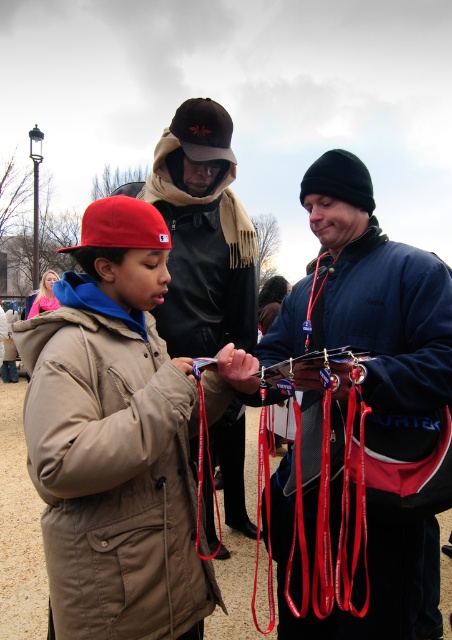
Is matte khaki jacket at center shorter than velvet blue jacket at center?

Indeed, matte khaki jacket at center has a lesser height compared to velvet blue jacket at center.

Can you confirm if matte khaki jacket at center is smaller than velvet blue jacket at center?

Yes, matte khaki jacket at center is smaller than velvet blue jacket at center.

This screenshot has height=640, width=452. In order to click on matte khaki jacket at center in this screenshot , I will do `click(114, 440)`.

Where is `matte khaki jacket at center`? The height and width of the screenshot is (640, 452). matte khaki jacket at center is located at coordinates (114, 440).

Who is more forward, (146, 230) or (191, 186)?

Point (146, 230)

Find the location of a particular element. The image size is (452, 640). matte khaki jacket at center is located at coordinates (114, 440).

Which is more to the left, velvet blue jacket at center or dark brown leather jacket at center?

From the viewer's perspective, dark brown leather jacket at center appears more on the left side.

Which is below, velvet blue jacket at center or dark brown leather jacket at center?

velvet blue jacket at center is below.

Is point (349, 518) farther from viewer compared to point (169, 314)?

No, (349, 518) is in front of (169, 314).

What are the coordinates of `velvet blue jacket at center` in the screenshot? It's located at (378, 298).